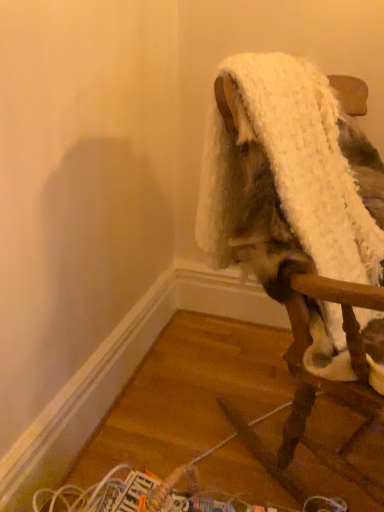
What do you see at coordinates (289, 261) in the screenshot? The height and width of the screenshot is (512, 384). I see `white fluffy blanket at upper right` at bounding box center [289, 261].

Measure the distance between white fluffy blanket at upper right and camera.

white fluffy blanket at upper right and camera are 31.29 inches apart from each other.

Where is `white fluffy blanket at upper right`? white fluffy blanket at upper right is located at coordinates (289, 261).

Where is `white fluffy blanket at upper right`? This screenshot has height=512, width=384. white fluffy blanket at upper right is located at coordinates (289, 261).